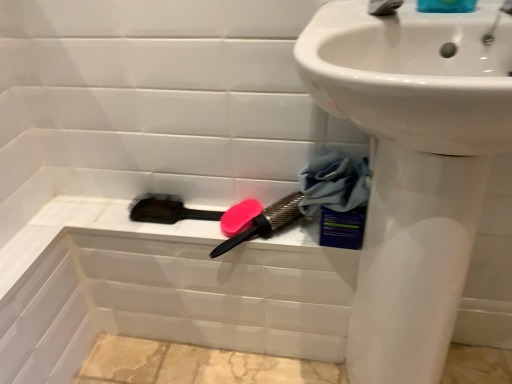
Question: From a real-world perspective, is blue glossy soap at upper right positioned over pink rubber brush at upper center, the 2th brush positioned from the left, based on gravity?

Choices:
 (A) yes
 (B) no

Answer: (A)

Question: From the image's perspective, is blue glossy soap at upper right over pink rubber brush at upper center, the 2th brush positioned from the left?

Choices:
 (A) yes
 (B) no

Answer: (A)

Question: Is blue glossy soap at upper right taller than pink rubber brush at upper center, the 2th brush positioned from the left?

Choices:
 (A) no
 (B) yes

Answer: (B)

Question: Can you confirm if blue glossy soap at upper right is wider than pink rubber brush at upper center, which appears as the 1th brush when viewed from the right?

Choices:
 (A) no
 (B) yes

Answer: (A)

Question: From a real-world perspective, is blue glossy soap at upper right positioned under pink rubber brush at upper center, the 2th brush positioned from the left, based on gravity?

Choices:
 (A) no
 (B) yes

Answer: (A)

Question: Visually, is blue fabric at lower right positioned to the left or to the right of pink rubber brush at upper center, which appears as the 1th brush when viewed from the right?

Choices:
 (A) right
 (B) left

Answer: (A)

Question: Looking at the image, does blue fabric at lower right seem bigger or smaller compared to pink rubber brush at upper center, which appears as the 1th brush when viewed from the right?

Choices:
 (A) big
 (B) small

Answer: (A)

Question: Is blue fabric at lower right wider or thinner than pink rubber brush at upper center, the 2th brush positioned from the left?

Choices:
 (A) wide
 (B) thin

Answer: (B)

Question: Would you say blue fabric at lower right is inside or outside pink rubber brush at upper center, the 2th brush positioned from the left?

Choices:
 (A) outside
 (B) inside

Answer: (A)

Question: Is silver metallic tap at upper right to the left or to the right of pink matte soap at center in the image?

Choices:
 (A) right
 (B) left

Answer: (A)

Question: Is point (397, 6) closer or farther from the camera than point (223, 218)?

Choices:
 (A) closer
 (B) farther

Answer: (A)

Question: In terms of size, does silver metallic tap at upper right appear bigger or smaller than pink matte soap at center?

Choices:
 (A) small
 (B) big

Answer: (B)

Question: From a real-world perspective, is silver metallic tap at upper right above or below pink matte soap at center?

Choices:
 (A) below
 (B) above

Answer: (B)

Question: Is black bristle brush at lower center, which ranks as the 1th brush in left-to-right order, to the left or to the right of blue fabric at lower right in the image?

Choices:
 (A) left
 (B) right

Answer: (A)

Question: Is point (150, 203) positioned closer to the camera than point (350, 160)?

Choices:
 (A) farther
 (B) closer

Answer: (A)